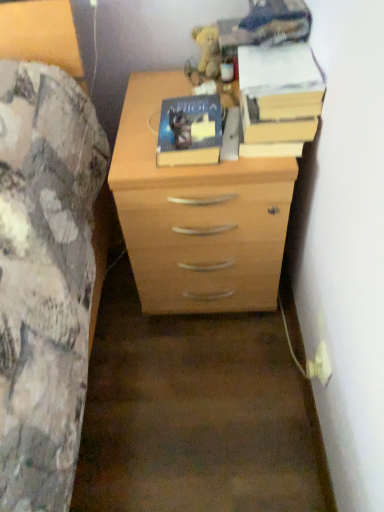
The image size is (384, 512). Describe the element at coordinates (279, 94) in the screenshot. I see `yellow paper at upper right, positioned as the 1th paperback book in right-to-left order` at that location.

Where is `light wood chest of drawers at center`? The height and width of the screenshot is (512, 384). light wood chest of drawers at center is located at coordinates (196, 215).

Describe the element at coordinates (196, 215) in the screenshot. This screenshot has height=512, width=384. I see `light wood chest of drawers at center` at that location.

Find the location of a particular element. The height and width of the screenshot is (512, 384). fuzzy yellow plush at upper center is located at coordinates (208, 50).

What do you see at coordinates (320, 365) in the screenshot? The image size is (384, 512). I see `white plastic plug at lower right` at bounding box center [320, 365].

Identify the location of yellow paper at upper right, which is counted as the 2th paperback book, starting from the left. (279, 94).

Is white plastic plug at lower right positioned with its back to light wood chest of drawers at center?

No, light wood chest of drawers at center is not at the back of white plastic plug at lower right.

Is light wood chest of drawers at center a part of white plastic plug at lower right?

No.

Between point (318, 361) and point (233, 253), which one is positioned behind?

The point (233, 253) is farther.

Looking at this image, from a real-world perspective, which object rests below the other?

From a 3D spatial view, white plastic plug at lower right is below.

Find the location of a particular element. This screenshot has height=512, width=384. toy that is above the white plastic plug at lower right (from the image's perspective) is located at coordinates (208, 50).

Which is in front, white plastic plug at lower right or fuzzy yellow plush at upper center?

white plastic plug at lower right is closer to the camera.

Choose the correct answer: Is white plastic plug at lower right inside fuzzy yellow plush at upper center or outside it?

The correct answer is: outside.

Is hardcover book at center, which appears as the 2th paperback book when viewed from the right, positioned with its back to light wood chest of drawers at center?

No, hardcover book at center, which appears as the 2th paperback book when viewed from the right, is not facing the opposite direction of light wood chest of drawers at center.

Is there a large distance between hardcover book at center, which appears as the first paperback book when viewed from the left, and light wood chest of drawers at center?

No, there isn't a large distance between hardcover book at center, which appears as the first paperback book when viewed from the left, and light wood chest of drawers at center.

Considering the relative sizes of hardcover book at center, which appears as the 2th paperback book when viewed from the right, and light wood chest of drawers at center in the image provided, is hardcover book at center, which appears as the 2th paperback book when viewed from the right, smaller than light wood chest of drawers at center?

Correct, hardcover book at center, which appears as the 2th paperback book when viewed from the right, occupies less space than light wood chest of drawers at center.

You are a GUI agent. You are given a task and a screenshot of the screen. Output one action in this format:
    pyautogui.click(x=<x>, y=<y>)
    Task: Click on the electric outlet that is under the fuzzy yellow plush at upper center (from a real-world perspective)
    Image resolution: width=384 pixels, height=512 pixels.
    Given the screenshot: What is the action you would take?
    pyautogui.click(x=320, y=365)

Is fuzzy yellow plush at upper center bigger than white plastic plug at lower right?

Correct, fuzzy yellow plush at upper center is larger in size than white plastic plug at lower right.

From a real-world perspective, is fuzzy yellow plush at upper center over white plastic plug at lower right?

Yes, from a real-world perspective, fuzzy yellow plush at upper center is on top of white plastic plug at lower right.

How different are the orientations of fuzzy yellow plush at upper center and white plastic plug at lower right in degrees?

There is a 89.3-degree angle between the facing directions of fuzzy yellow plush at upper center and white plastic plug at lower right.

From a real-world perspective, is light wood chest of drawers at center above or below white plastic plug at lower right?

From a real-world perspective, light wood chest of drawers at center is physically above white plastic plug at lower right.

Is light wood chest of drawers at center behind white plastic plug at lower right?

No, light wood chest of drawers at center is in front of white plastic plug at lower right.

From the image's perspective, between light wood chest of drawers at center and white plastic plug at lower right, which one is located above?

light wood chest of drawers at center.

Is light wood chest of drawers at center next to white plastic plug at lower right and touching it?

No, light wood chest of drawers at center is not with white plastic plug at lower right.

Is hardcover book at center, which appears as the first paperback book when viewed from the left, wider or thinner than fuzzy yellow plush at upper center?

Clearly, hardcover book at center, which appears as the first paperback book when viewed from the left, has more width compared to fuzzy yellow plush at upper center.

Who is smaller, hardcover book at center, which appears as the first paperback book when viewed from the left, or fuzzy yellow plush at upper center?

With smaller size is fuzzy yellow plush at upper center.

Does hardcover book at center, which appears as the 2th paperback book when viewed from the right, have a lesser height compared to fuzzy yellow plush at upper center?

Correct, hardcover book at center, which appears as the 2th paperback book when viewed from the right, is not as tall as fuzzy yellow plush at upper center.

Relative to hardcover book at center, which appears as the 2th paperback book when viewed from the right, is yellow paper at upper right, positioned as the 1th paperback book in right-to-left order, in front or behind?

yellow paper at upper right, positioned as the 1th paperback book in right-to-left order, is in front of hardcover book at center, which appears as the 2th paperback book when viewed from the right.

Would you say yellow paper at upper right, positioned as the 1th paperback book in right-to-left order, is a long distance from hardcover book at center, which appears as the 2th paperback book when viewed from the right?

No, yellow paper at upper right, positioned as the 1th paperback book in right-to-left order, is in close proximity to hardcover book at center, which appears as the 2th paperback book when viewed from the right.

Does yellow paper at upper right, which is counted as the 2th paperback book, starting from the left, have a greater width compared to hardcover book at center, which appears as the first paperback book when viewed from the left?

Yes, yellow paper at upper right, which is counted as the 2th paperback book, starting from the left, is wider than hardcover book at center, which appears as the first paperback book when viewed from the left.

From a real-world perspective, relative to hardcover book at center, which appears as the 2th paperback book when viewed from the right, is yellow paper at upper right, positioned as the 1th paperback book in right-to-left order, vertically above or below?

From a real-world perspective, yellow paper at upper right, positioned as the 1th paperback book in right-to-left order, is physically above hardcover book at center, which appears as the 2th paperback book when viewed from the right.

At what (x,y) coordinates should I click in order to perform the action: click on chest of drawers on the left side of white plastic plug at lower right. Please return your answer as a coordinate pair (x, y). Looking at the image, I should click on (196, 215).

Locate an element on the screen. The height and width of the screenshot is (512, 384). electric outlet that appears on the right of fuzzy yellow plush at upper center is located at coordinates (320, 365).

Looking at the image, which one is located further to light wood chest of drawers at center, white plastic plug at lower right or yellow paper at upper right, which is counted as the 2th paperback book, starting from the left?

white plastic plug at lower right lies further to light wood chest of drawers at center than the other object.

Considering their positions, is hardcover book at center, which appears as the 2th paperback book when viewed from the right, positioned further to white plastic plug at lower right than light wood chest of drawers at center?

hardcover book at center, which appears as the 2th paperback book when viewed from the right, lies further to white plastic plug at lower right than the other object.

Consider the image. From the image, which object appears to be farther from light wood chest of drawers at center, yellow paper at upper right, positioned as the 1th paperback book in right-to-left order, or hardcover book at center, which appears as the 2th paperback book when viewed from the right?

yellow paper at upper right, positioned as the 1th paperback book in right-to-left order, lies further to light wood chest of drawers at center than the other object.

Estimate the real-world distances between objects in this image. Which object is further from light wood chest of drawers at center, fuzzy yellow plush at upper center or yellow paper at upper right, positioned as the 1th paperback book in right-to-left order?

fuzzy yellow plush at upper center is positioned further to the anchor light wood chest of drawers at center.

From the image, which object appears to be farther from yellow paper at upper right, positioned as the 1th paperback book in right-to-left order, fuzzy yellow plush at upper center or white plastic plug at lower right?

Based on the image, white plastic plug at lower right appears to be further to yellow paper at upper right, positioned as the 1th paperback book in right-to-left order.

When comparing their distances from white plastic plug at lower right, does fuzzy yellow plush at upper center or hardcover book at center, which appears as the first paperback book when viewed from the left, seem further?

fuzzy yellow plush at upper center is positioned further to the anchor white plastic plug at lower right.

Estimate the real-world distances between objects in this image. Which object is closer to hardcover book at center, which appears as the first paperback book when viewed from the left, fuzzy yellow plush at upper center or yellow paper at upper right, which is counted as the 2th paperback book, starting from the left?

yellow paper at upper right, which is counted as the 2th paperback book, starting from the left.

From the image, which object appears to be nearer to hardcover book at center, which appears as the 2th paperback book when viewed from the right, fuzzy yellow plush at upper center or light wood chest of drawers at center?

light wood chest of drawers at center lies closer to hardcover book at center, which appears as the 2th paperback book when viewed from the right, than the other object.

Identify the location of the chest of drawers that lies between yellow paper at upper right, which is counted as the 2th paperback book, starting from the left, and white plastic plug at lower right from top to bottom. This screenshot has width=384, height=512. (196, 215).

At what (x,y) coordinates should I click in order to perform the action: click on paperback book between yellow paper at upper right, positioned as the 1th paperback book in right-to-left order, and white plastic plug at lower right vertically. Please return your answer as a coordinate pair (x, y). Looking at the image, I should click on (189, 131).

Where is `paperback book between fuzzy yellow plush at upper center and hardcover book at center, which appears as the 2th paperback book when viewed from the right, in the vertical direction`? paperback book between fuzzy yellow plush at upper center and hardcover book at center, which appears as the 2th paperback book when viewed from the right, in the vertical direction is located at coordinates (279, 94).

What are the coordinates of `chest of drawers between fuzzy yellow plush at upper center and white plastic plug at lower right in the vertical direction` in the screenshot? It's located at (196, 215).